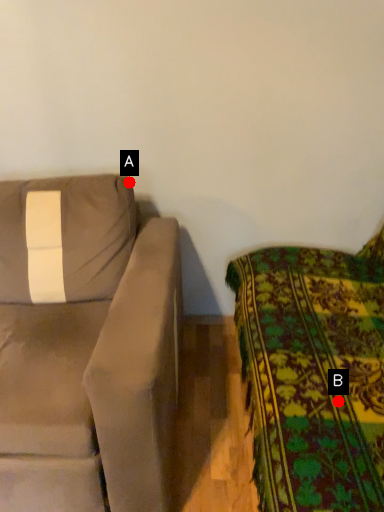
Question: Two points are circled on the image, labeled by A and B beside each circle. Which point is farther from the camera taking this photo?

Choices:
 (A) A is further
 (B) B is further

Answer: (A)